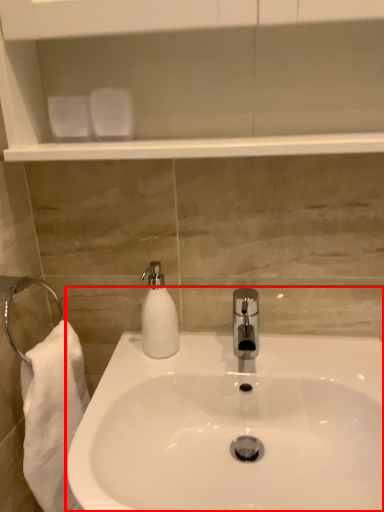
Question: Where is sink (annotated by the red box) located in relation to soap dispenser in the image?

Choices:
 (A) left
 (B) right

Answer: (B)